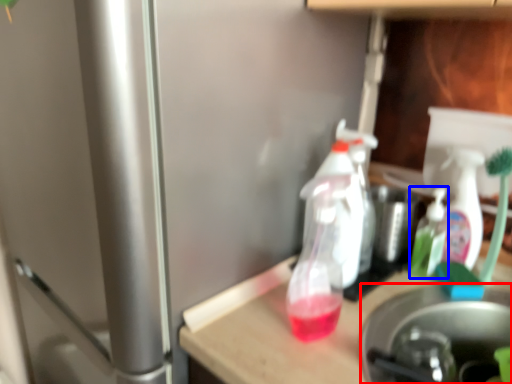
Question: Which object appears farthest to the camera in this image, appliance (highlighted by a red box) or bottle (highlighted by a blue box)?

Choices:
 (A) appliance
 (B) bottle

Answer: (B)